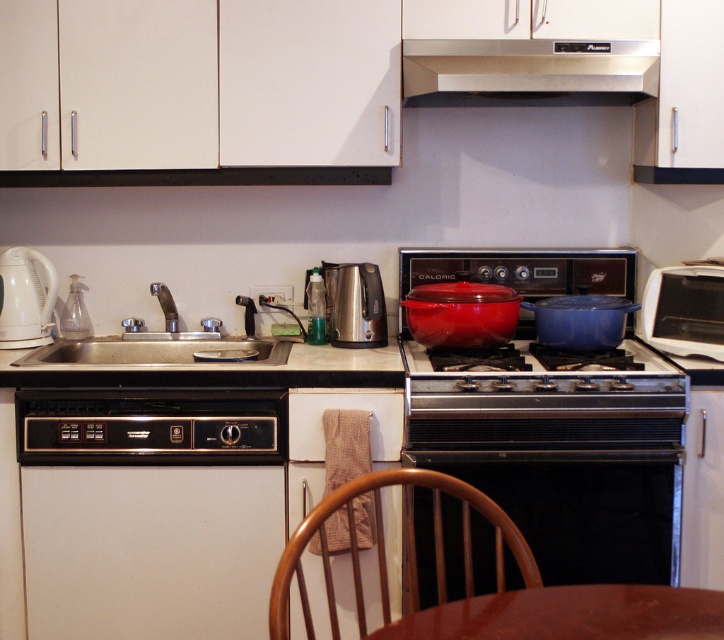
Can you confirm if white matte dishwasher at lower left is thinner than beige laminate countertop at lower left?

Correct, white matte dishwasher at lower left's width is less than beige laminate countertop at lower left's.

Does white matte dishwasher at lower left have a larger size compared to beige laminate countertop at lower left?

Actually, white matte dishwasher at lower left might be smaller than beige laminate countertop at lower left.

Who is more forward, (x=230, y=552) or (x=43, y=362)?

Point (x=230, y=552) is in front.

Identify the location of white matte dishwasher at lower left. This screenshot has height=640, width=724. (151, 518).

Which of these two, beige laminate countertop at lower left or stainless steel sink at center, stands taller?

With more height is stainless steel sink at center.

Is beige laminate countertop at lower left bigger than stainless steel sink at center?

Incorrect, beige laminate countertop at lower left is not larger than stainless steel sink at center.

Who is more forward, (232, 344) or (190, 346)?

Point (190, 346) is in front.

The height and width of the screenshot is (640, 724). Find the location of `beige laminate countertop at lower left`. beige laminate countertop at lower left is located at coordinates (206, 362).

Is stainless steel exhaust hood at upper center positioned before matte black cookware at center?

No, it is not.

Which is in front, point (580, 92) or point (424, 403)?

Point (424, 403)

This screenshot has width=724, height=640. I want to click on stainless steel exhaust hood at upper center, so click(x=526, y=72).